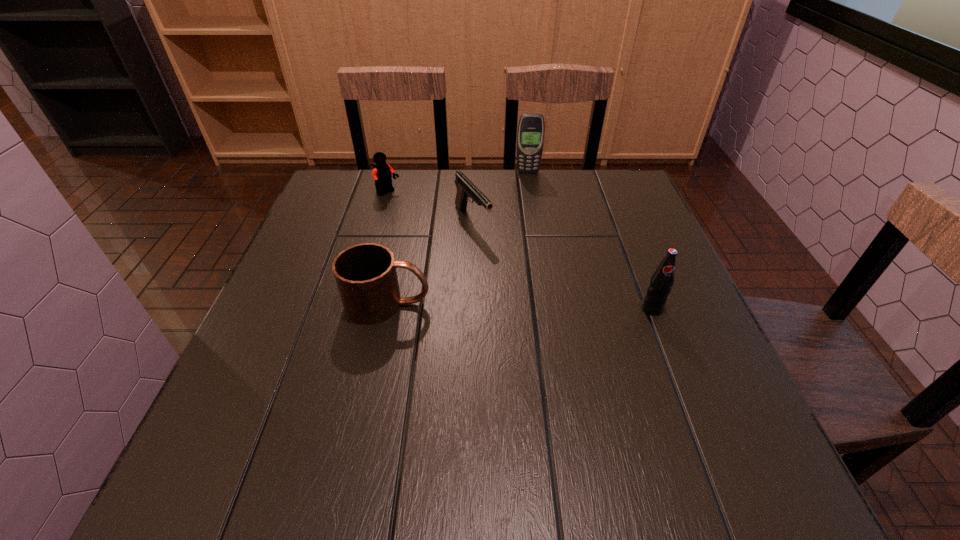
I want to click on vacant spot on the desktop that is between the mug and the rightmost object and is positioned on the front-facing side of the Lego, so click(x=520, y=306).

Image resolution: width=960 pixels, height=540 pixels. I want to click on vacant space on the desktop that is between the mug and the second tallest object and is positioned at the muzzle of the third farthest object, so click(x=548, y=307).

Locate an element on the screen. vacant space on the desktop that is between the mug and the pop and is positioned on the screen of the farthest object is located at coordinates (538, 307).